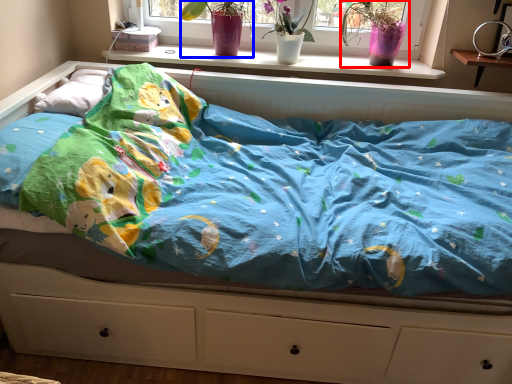
Question: Among these objects, which one is farthest to the camera, floral arrangement (highlighted by a red box) or floral arrangement (highlighted by a blue box)?

Choices:
 (A) floral arrangement
 (B) floral arrangement

Answer: (A)